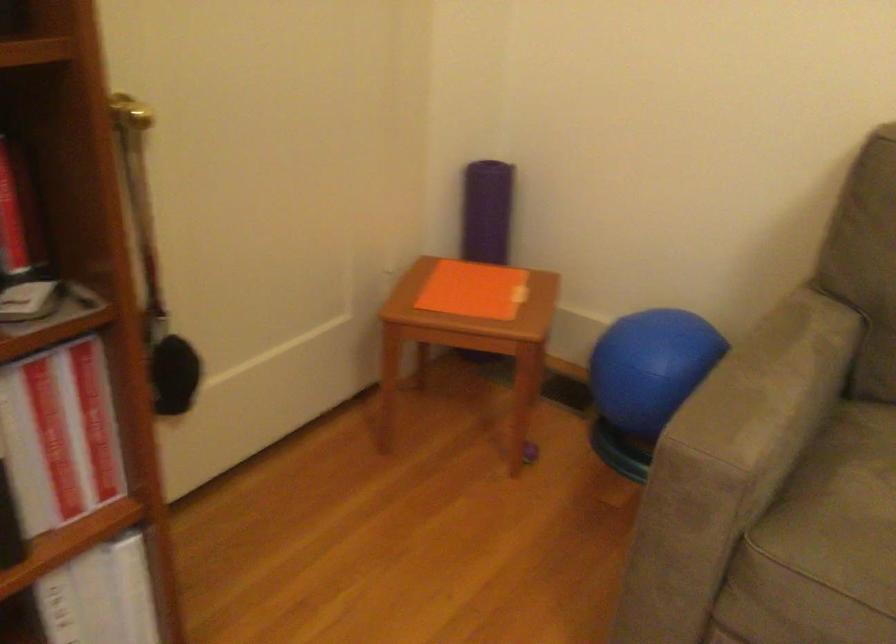
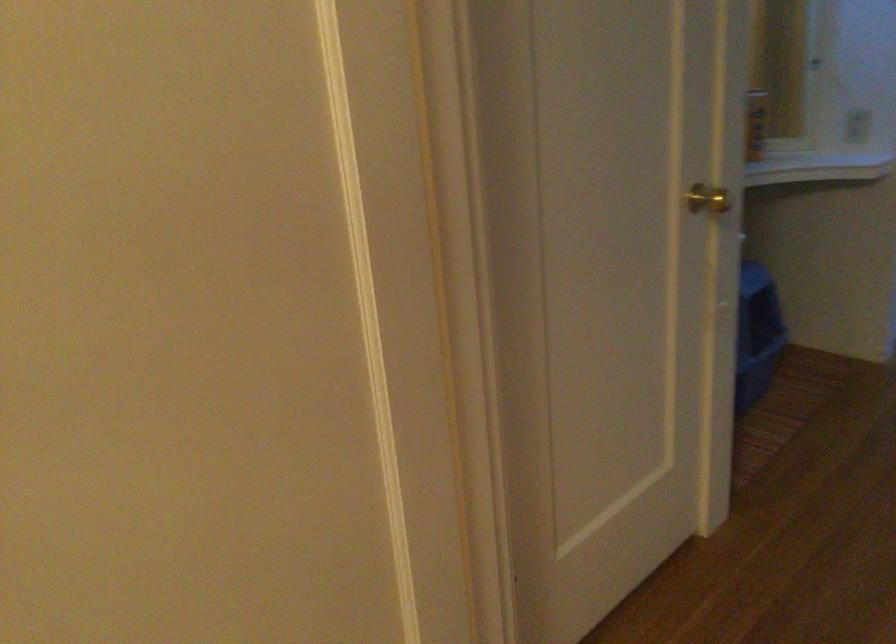
First-person continuous shooting, in which direction is the camera rotating?

The camera rotated toward left-down.